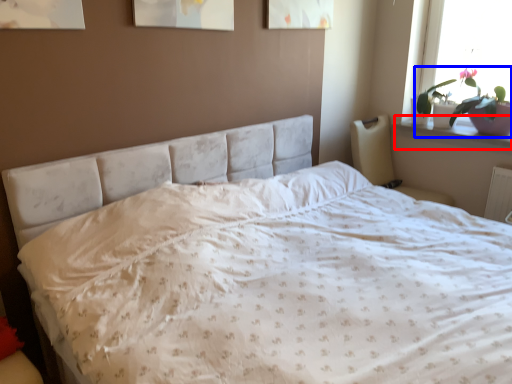
Question: Which of the following is the closest to the observer, window sill (highlighted by a red box) or houseplant (highlighted by a blue box)?

Choices:
 (A) window sill
 (B) houseplant

Answer: (B)